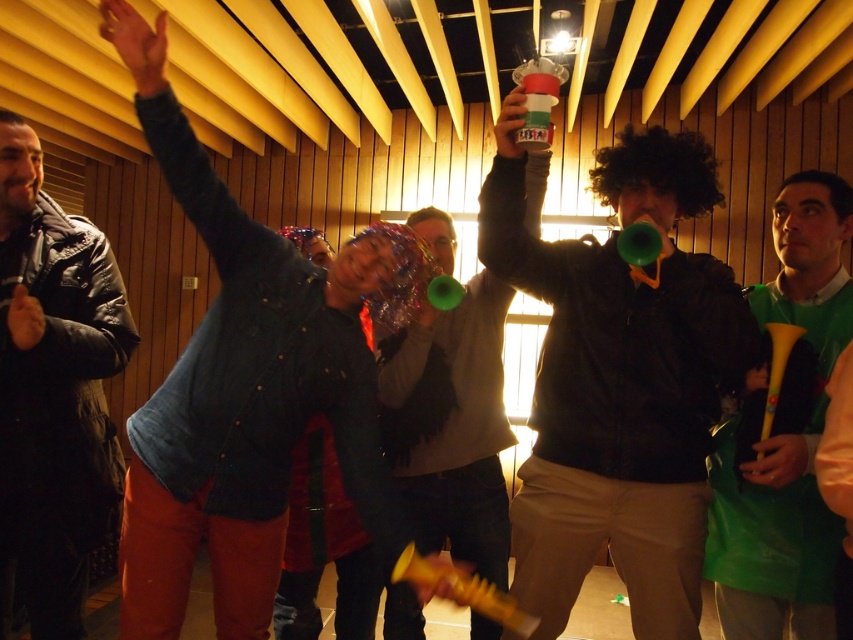
You are organizing a costume party and need to decide which item to place in a gift box. The denim jacket at center and the green plastic horn at right are both candidates. Given their sizes, which one can fit better in a standard gift box that can hold items up to the size of the green plastic horn?

The green plastic horn at right can fit better in the gift box since the denim jacket at center is larger in size compared to the green plastic horn at right.

You are standing in the middle of the room and want to move towards the two points. Which point, point (346,269) or point (38,227), is closer to you?

Point (346,269) is closer to the viewer than point (38,227), so you should move towards point (346,269) first.